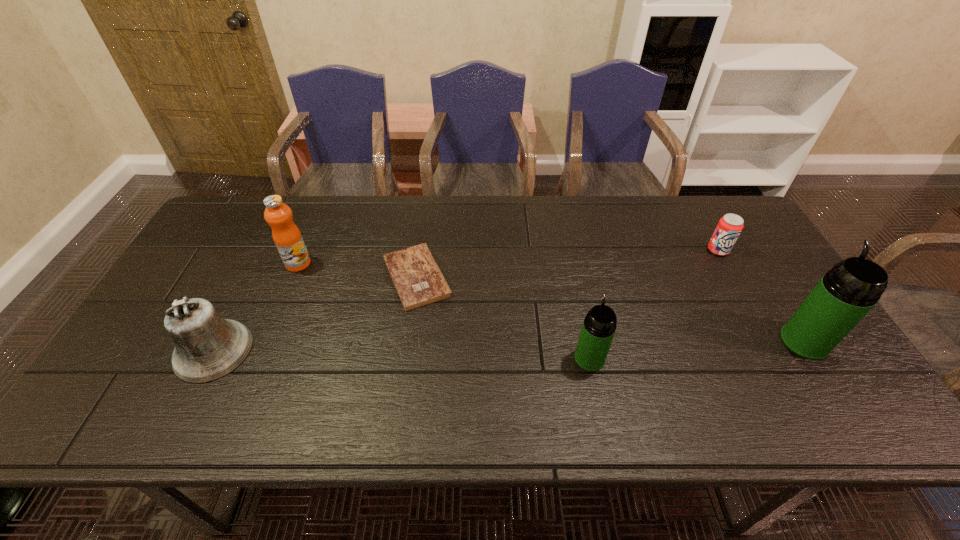
Find the location of `free space at the far left corner`. free space at the far left corner is located at coordinates (236, 228).

Identify the location of free point at the near left corner. (173, 375).

Where is `vacant space that's between the fourth object from left to right and the right thermos bottle`? This screenshot has width=960, height=540. vacant space that's between the fourth object from left to right and the right thermos bottle is located at coordinates (697, 350).

The width and height of the screenshot is (960, 540). Find the location of `empty space between the shorter thermos bottle and the bell`. empty space between the shorter thermos bottle and the bell is located at coordinates (401, 354).

The height and width of the screenshot is (540, 960). I want to click on vacant area that lies between the left thermos bottle and the taller thermos bottle, so click(x=697, y=350).

The width and height of the screenshot is (960, 540). Identify the location of free space between the fifth tallest object and the fruit juice. (508, 257).

At what (x,y) coordinates should I click in order to perform the action: click on free space that is in between the shorter thermos bottle and the bell. Please return your answer as a coordinate pair (x, y). Image resolution: width=960 pixels, height=540 pixels. Looking at the image, I should click on (401, 354).

In order to click on free space that is in between the fifth tallest object and the shortest object in this screenshot , I will do `click(567, 263)`.

Where is `vacant point located between the fruit juice and the taller thermos bottle`? Image resolution: width=960 pixels, height=540 pixels. vacant point located between the fruit juice and the taller thermos bottle is located at coordinates (551, 302).

Where is `free space between the fourth object from left to right and the soda can`? free space between the fourth object from left to right and the soda can is located at coordinates (654, 304).